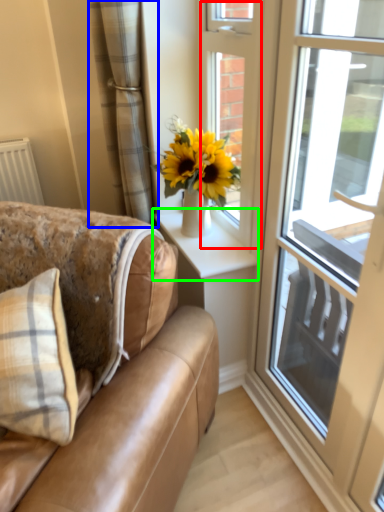
Question: Which object is positioned farthest from door (highlighted by a red box)? Select from curtain (highlighted by a blue box) and window sill (highlighted by a green box).

Choices:
 (A) curtain
 (B) window sill

Answer: (A)